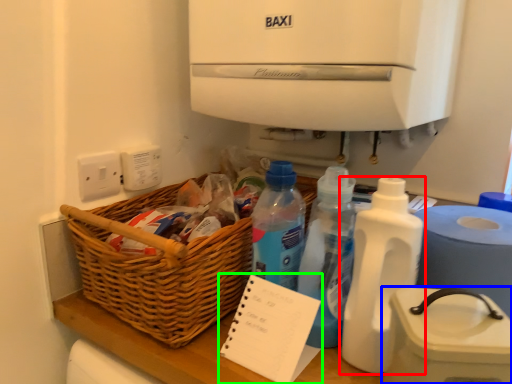
Question: Which is farther away from bottle (highlighted by a red box)? appliance (highlighted by a blue box) or notepad (highlighted by a green box)?

Choices:
 (A) appliance
 (B) notepad

Answer: (B)